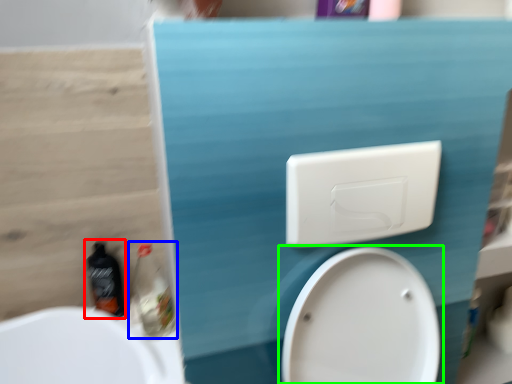
Question: Which object is the closest to the bottle (highlighted by a red box)? Choose among these: cleaning product (highlighted by a blue box) or toilet (highlighted by a green box).

Choices:
 (A) cleaning product
 (B) toilet

Answer: (A)